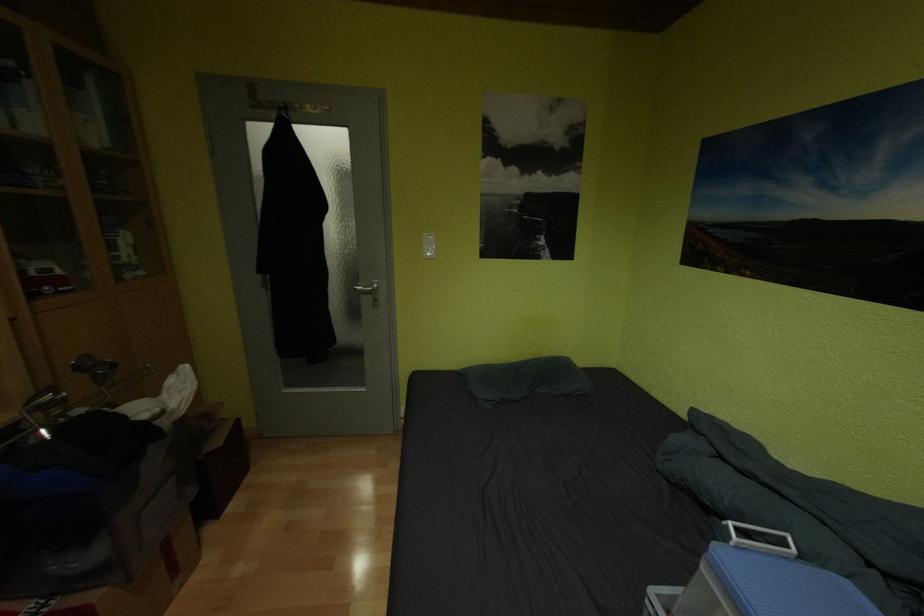
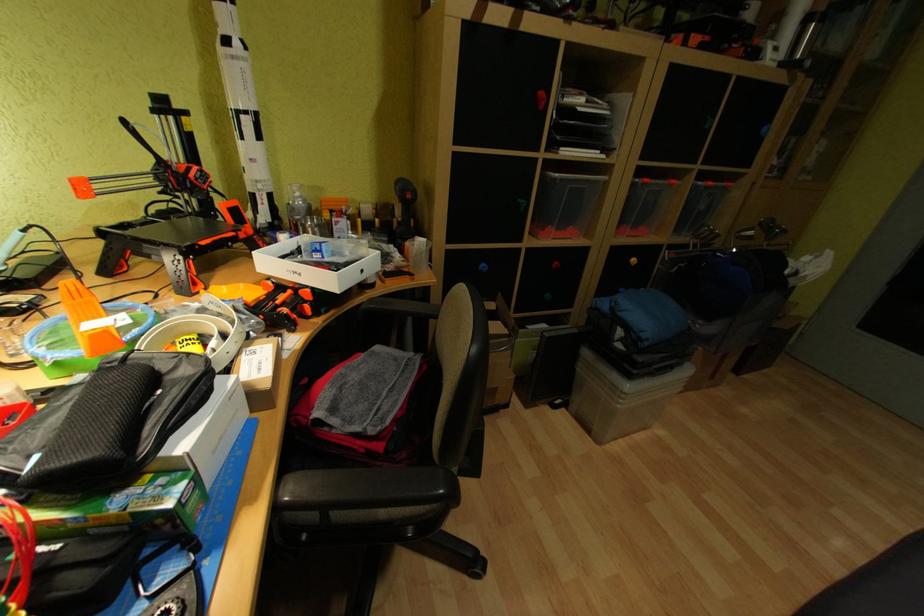
Based on the continuous images, in which direction is the camera rotating?

The camera's rotation is toward left-down.